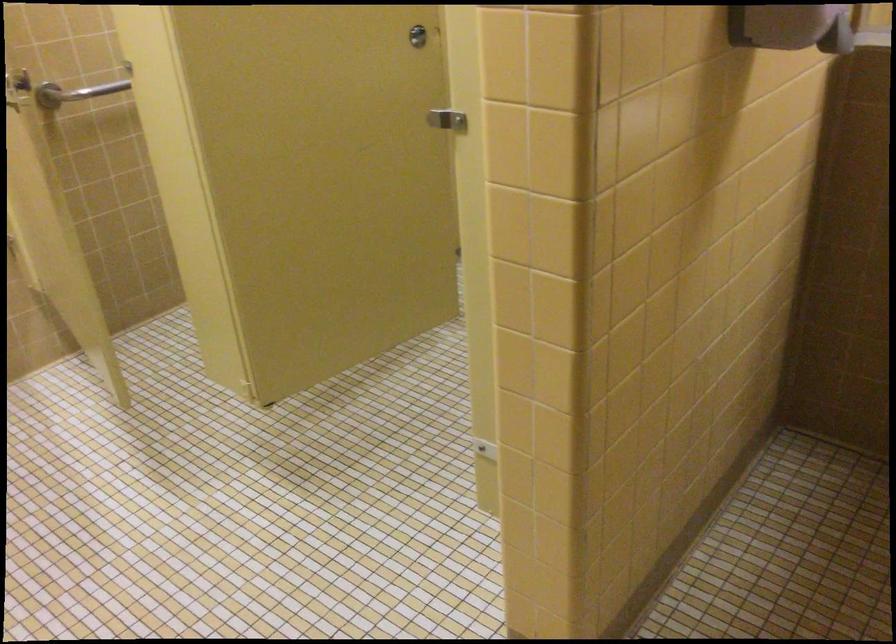
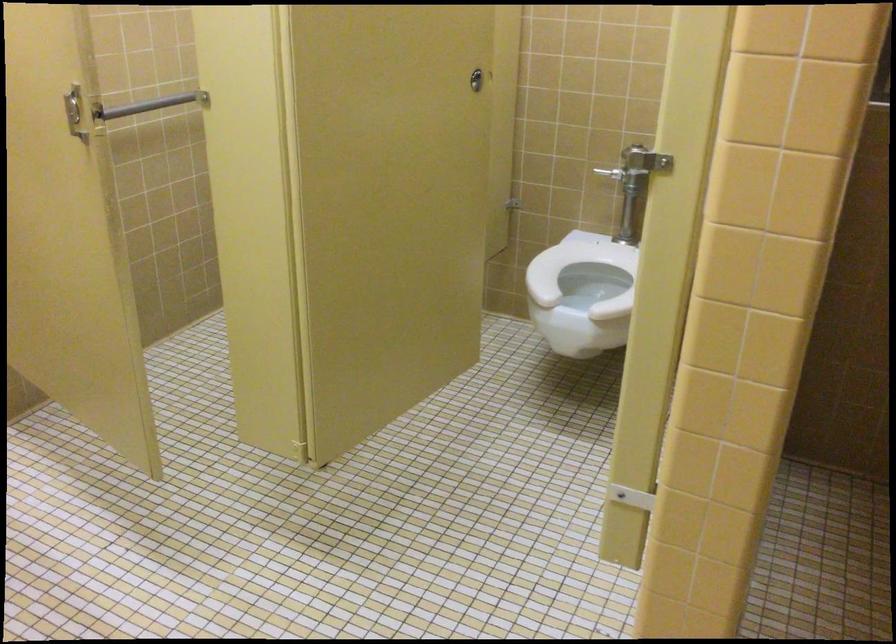
Question: The camera is either moving clockwise (left) or counter-clockwise (right) around the object. The first image is from the beginning of the video and the second image is from the end. Is the camera moving left or right when shooting the video?

Choices:
 (A) Left
 (B) Right

Answer: (A)